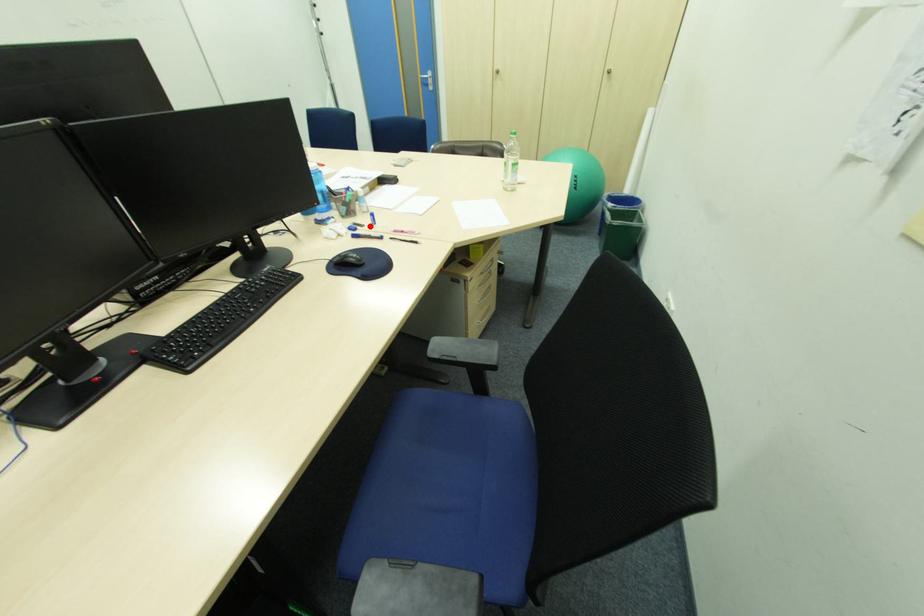
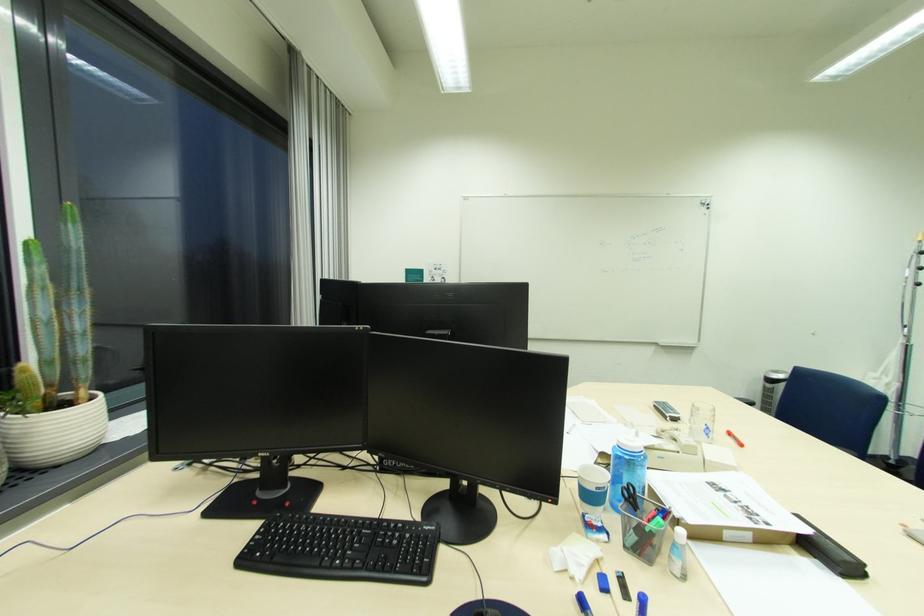
The point at the highlighted location is marked in the first image. Where is the corresponding point in the second image?

(636, 601)